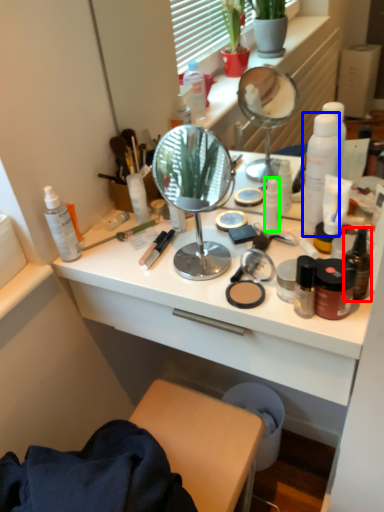
Question: Which object is positioned closest to bottle (highlighted by a red box)? Select from bottle (highlighted by a blue box) and toiletry (highlighted by a green box).

Choices:
 (A) bottle
 (B) toiletry

Answer: (A)